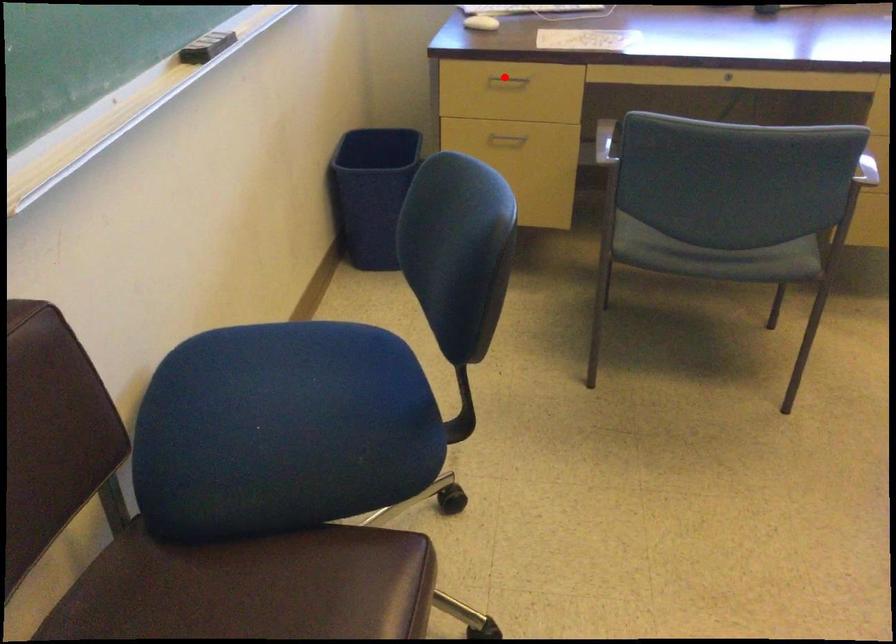
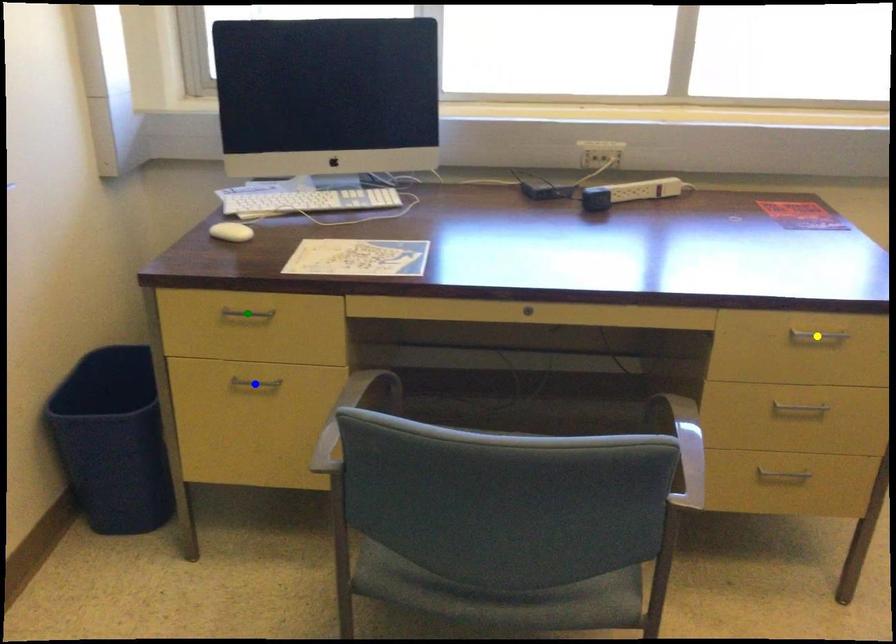
Question: I am providing you with two images of the same scene from different viewpoints. A red point is marked on the first image. You are given multiple points on the second image. Which point in image 2 is actually the same real-world point as the red point in image 1?

Choices:
 (A) blue point
 (B) yellow point
 (C) green point

Answer: (C)